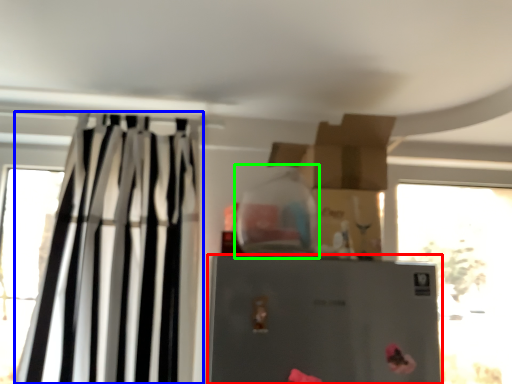
Question: Based on their relative distances, which object is farther from refrigerator (highlighted by a red box)? Choose from curtain (highlighted by a blue box) and bottle (highlighted by a green box).

Choices:
 (A) curtain
 (B) bottle

Answer: (A)